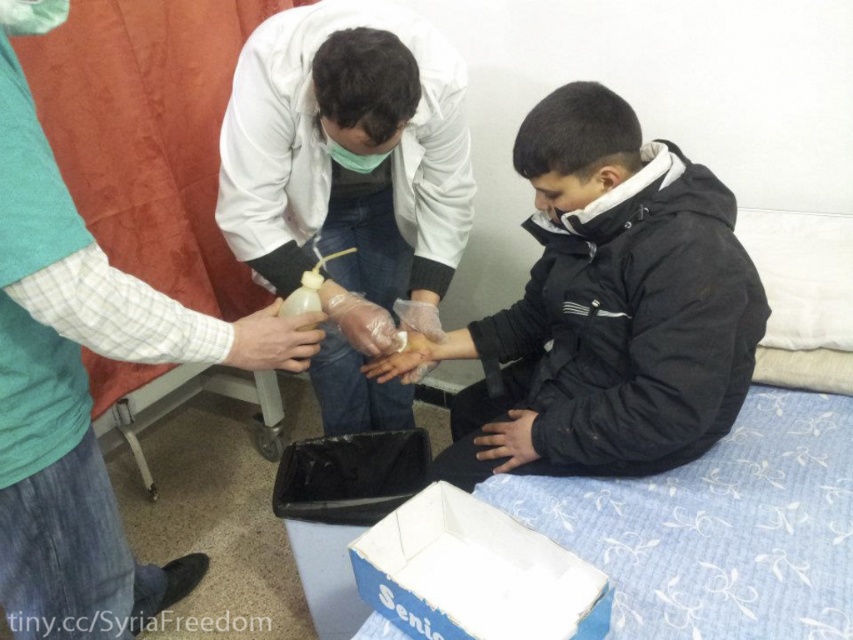
Is point (39, 272) closer to viewer compared to point (386, 230)?

Yes, point (39, 272) is closer to viewer.

Is white matte coat at upper left wider than white matte lab coat at center?

In fact, white matte coat at upper left might be narrower than white matte lab coat at center.

Describe the element at coordinates (68, 385) in the screenshot. I see `white matte coat at upper left` at that location.

I want to click on white matte coat at upper left, so click(68, 385).

Based on the photo, between black matte jacket at center and translucent plastic bottle at center, which one is positioned higher?

black matte jacket at center is above.

Is point (601, 385) positioned after point (236, 358)?

Yes, it is behind point (236, 358).

Does point (699, 404) come closer to viewer compared to point (263, 346)?

No, it is behind (263, 346).

The image size is (853, 640). What are the coordinates of `black matte jacket at center` in the screenshot? It's located at (606, 308).

Does white matte coat at upper left have a lesser height compared to blue cardboard box at lower center?

No, white matte coat at upper left is not shorter than blue cardboard box at lower center.

Who is positioned more to the left, white matte coat at upper left or blue cardboard box at lower center?

white matte coat at upper left is more to the left.

This screenshot has width=853, height=640. In order to click on white matte coat at upper left in this screenshot , I will do `click(68, 385)`.